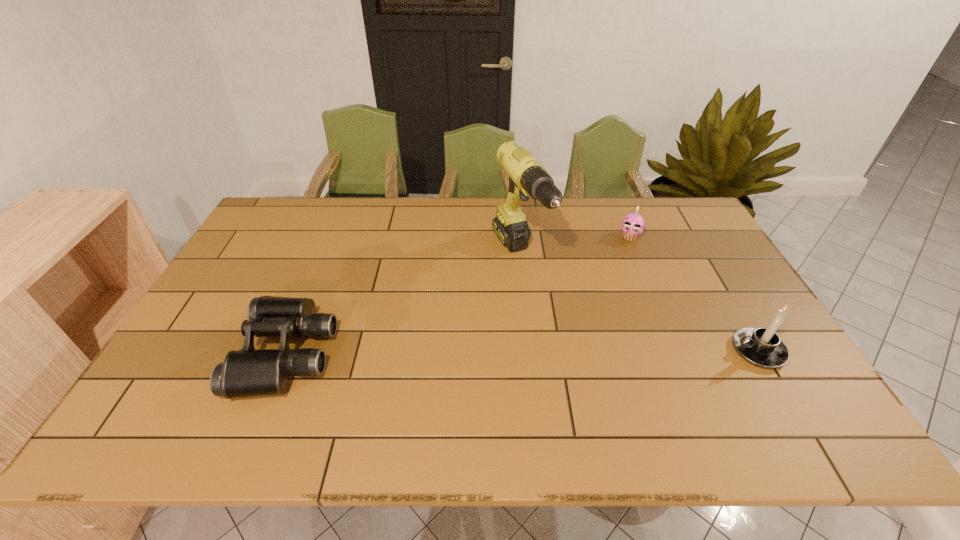
This screenshot has width=960, height=540. I want to click on vacant point located between the leftmost object and the second tallest object, so click(522, 352).

Identify the location of vacant region between the cupcake and the binoculars. This screenshot has width=960, height=540. (459, 295).

At what (x,y) coordinates should I click in order to perform the action: click on vacant space that is in between the second object from right to left and the candle holder. Please return your answer as a coordinate pair (x, y). Looking at the image, I should click on (694, 294).

Image resolution: width=960 pixels, height=540 pixels. What are the coordinates of `empty space between the third object from left to right and the second object from left to right` in the screenshot? It's located at (575, 246).

Where is `free spot between the second tallest object and the binoculars`? free spot between the second tallest object and the binoculars is located at coordinates (522, 352).

Where is `free area in between the drill and the cupcake`? This screenshot has width=960, height=540. free area in between the drill and the cupcake is located at coordinates (575, 246).

Where is `vacant area between the third shortest object and the cupcake`? Image resolution: width=960 pixels, height=540 pixels. vacant area between the third shortest object and the cupcake is located at coordinates (694, 294).

Locate an element on the screen. The image size is (960, 540). vacant region between the rightmost object and the tallest object is located at coordinates click(x=638, y=303).

The width and height of the screenshot is (960, 540). I want to click on vacant space in between the cupcake and the leftmost object, so click(459, 295).

In order to click on free spot between the drill and the leftmost object in this screenshot , I will do `click(403, 305)`.